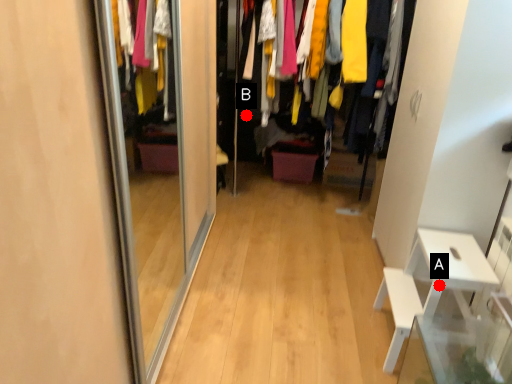
Question: Two points are circled on the image, labeled by A and B beside each circle. Which point is closer to the camera?

Choices:
 (A) A is closer
 (B) B is closer

Answer: (A)